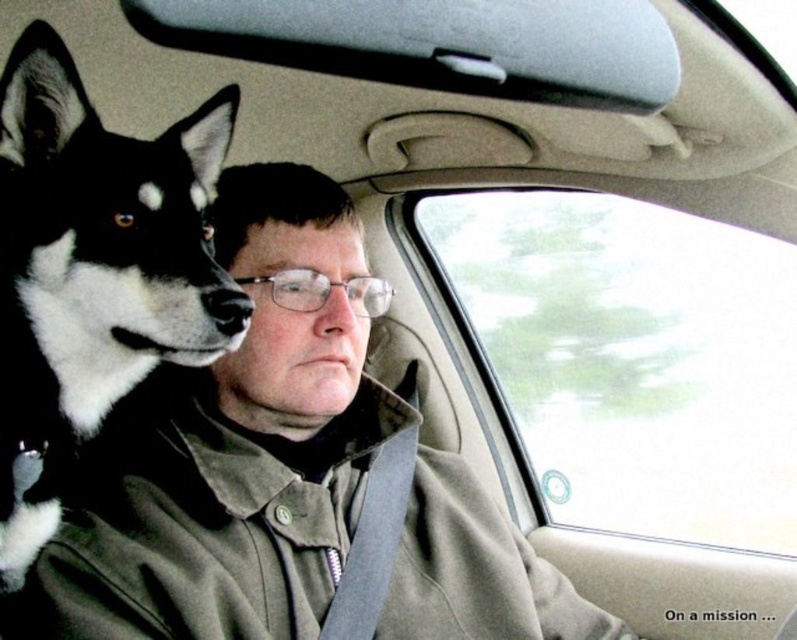
You are a passenger in the car and want to look at the view outside through the transparent glass window at center without disturbing the black fur dog at left. Which side of the dog should you move to?

The transparent glass window at center is positioned on the right side of the black fur dog at left. To look through the window without disturbing the dog, you should move to the right side of the black fur dog at left.

You are a passenger in the car and need to store a small backpack. You see the brown textured fabric trench coat at center and the black fur dog at left. Which object can you place the backpack on top of?

The brown textured fabric trench coat at center is larger in size than the black fur dog at left, so the backpack can be placed on top of the brown textured fabric trench coat at center.